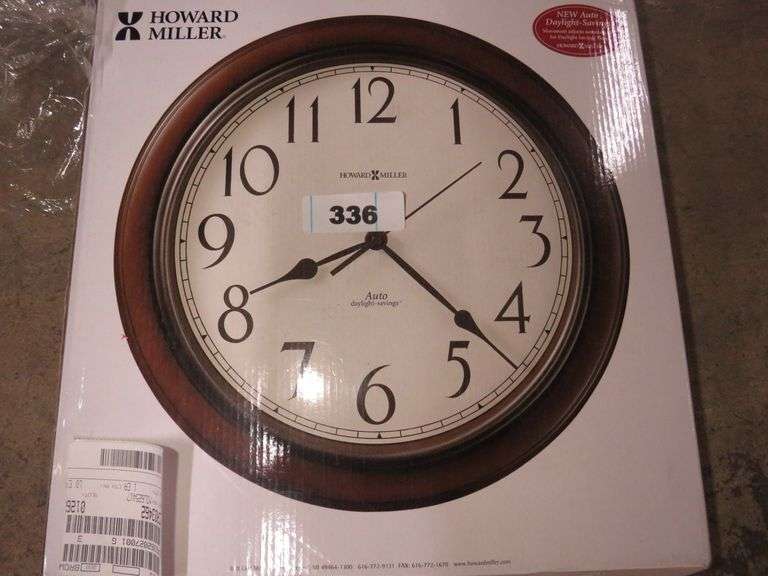
The width and height of the screenshot is (768, 576). What are the coordinates of `sticker` in the screenshot? It's located at (329, 226).